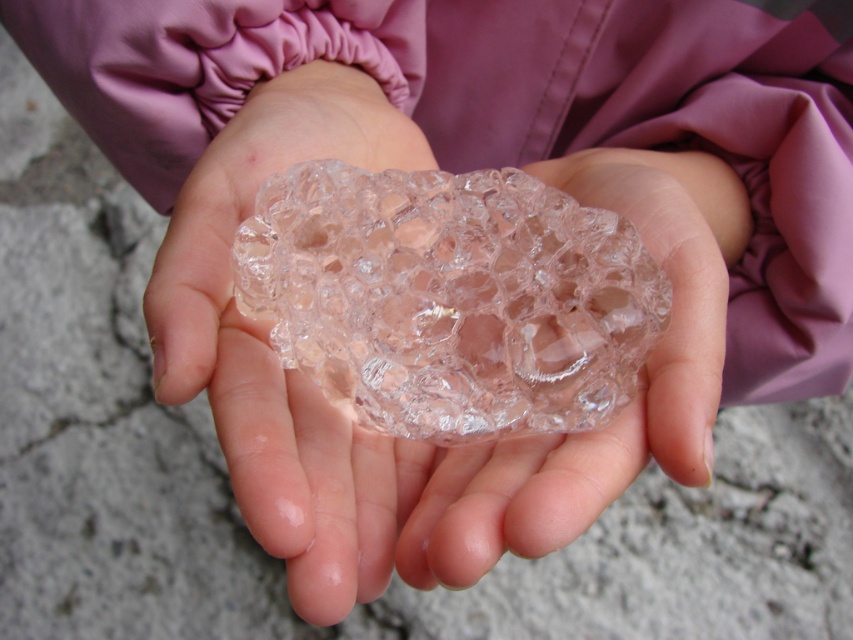
You are a delivery person who needs to place both the transparent plastic rock at center and the transparent glass crystal at center into a box that is 3 inches wide. Can you fit both items side by side in the box without overlapping?

The transparent plastic rock at center is 3.19 inches away from the transparent glass crystal at center, meaning the total width required to place them side by side is 3.19 inches. Since the box is exactly 3 inches wide, the items cannot fit side by side without overlapping.

You are holding the transparent plastic rock at center. If your eyes are 20 inches away from the object, can you see it clearly?

The transparent plastic rock at center is 18.11 inches away from the viewer, so if your eyes are 20 inches away, you are slightly farther than the actual distance. However, since the difference is small, you should still be able to see it clearly.

You are a robotic arm trying to pick up the transparent plastic rock at center. What coordinate should you move to in order to grab it?

The transparent plastic rock at center is located at coordinate point [403,438], so the robotic arm should move to that coordinate to grab it.